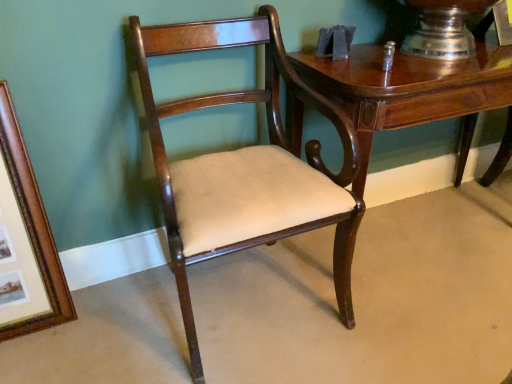
Question: Would you say glossy wood table at upper right is to the left or to the right of wooden picture frame at left in the picture?

Choices:
 (A) left
 (B) right

Answer: (B)

Question: From the image's perspective, is glossy wood table at upper right above or below wooden picture frame at left?

Choices:
 (A) above
 (B) below

Answer: (A)

Question: Which of these objects is positioned closest to the glossy wood table at upper right?

Choices:
 (A) wooden picture frame at left
 (B) mahogany wood chair at center

Answer: (B)

Question: Based on their relative distances, which object is farther from the wooden picture frame at left?

Choices:
 (A) glossy wood table at upper right
 (B) mahogany wood chair at center

Answer: (A)